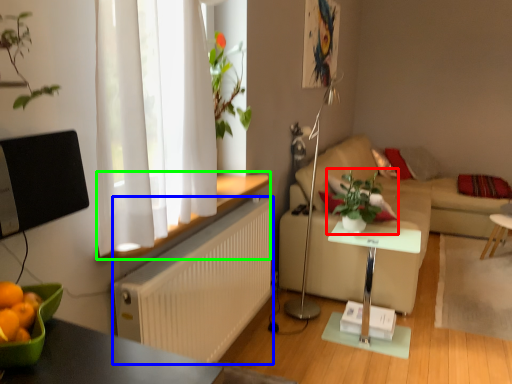
Question: Which object is the farthest from houseplant (highlighted by a red box)? Choose among these: radiator (highlighted by a blue box) or window sill (highlighted by a green box).

Choices:
 (A) radiator
 (B) window sill

Answer: (A)